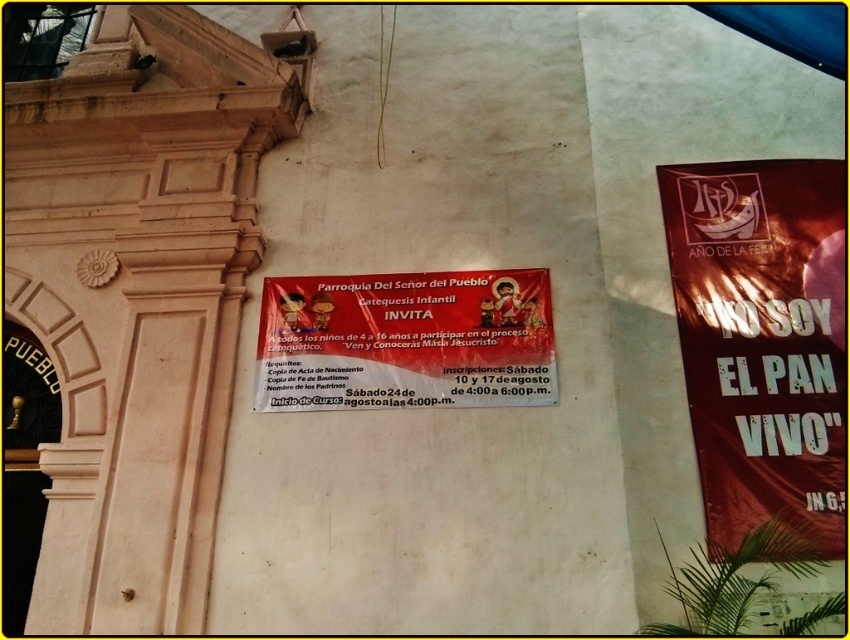
You are a visitor approaching the building and want to read both the metallic gold banner at right and the matte paper poster at center. Which one should you look at first if you want to read them in the order they appear from left to right?

You should look at the matte paper poster at center first because it is positioned to the left of the metallic gold banner at right.

You are standing in front of the building and want to hang a metallic gold banner at right. Is the spot where you want to hang it already occupied?

The metallic gold banner at right is already present at point (x=762, y=339), so the spot is occupied.